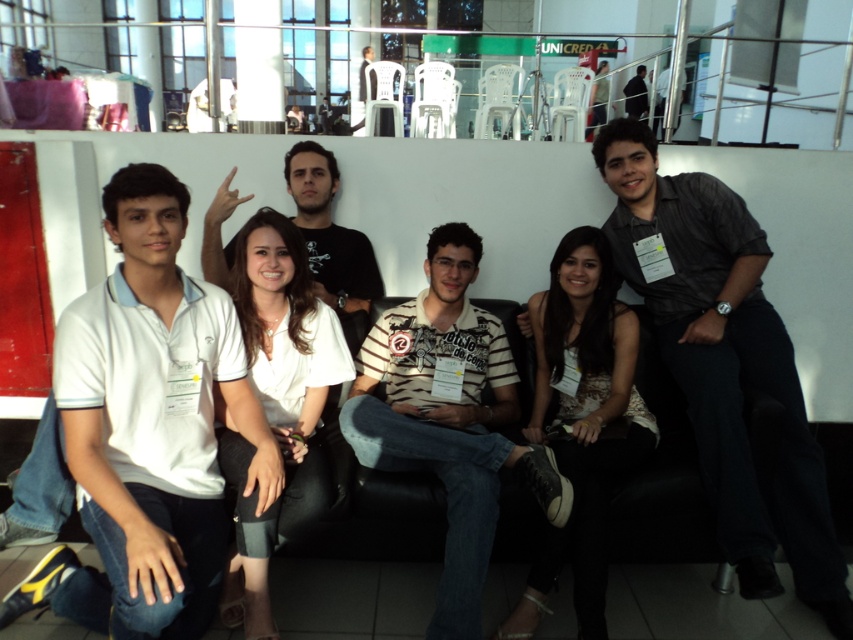
Question: Does white cotton polo shirt at left have a lesser width compared to dark gray shirt at center?

Choices:
 (A) no
 (B) yes

Answer: (B)

Question: Which object is farther from the camera taking this photo?

Choices:
 (A) striped cotton shirt at center
 (B) white cotton polo shirt at left
 (C) black shirt at upper center

Answer: (C)

Question: Which is nearer to the black shirt at upper center?

Choices:
 (A) white cotton polo shirt at left
 (B) dark gray shirt at center
 (C) black t-shirt at center

Answer: (B)

Question: Which of these objects is positioned farthest from the black t-shirt at center?

Choices:
 (A) striped cotton shirt at center
 (B) white cotton polo shirt at left
 (C) black shirt at upper center
 (D) dark gray shirt at center

Answer: (C)

Question: From the image, what is the correct spatial relationship of striped cotton shirt at center in relation to black shirt at upper center?

Choices:
 (A) left
 (B) right

Answer: (A)

Question: Considering the relative positions of black t-shirt at center and black shirt at upper center in the image provided, where is black t-shirt at center located with respect to black shirt at upper center?

Choices:
 (A) left
 (B) right

Answer: (A)